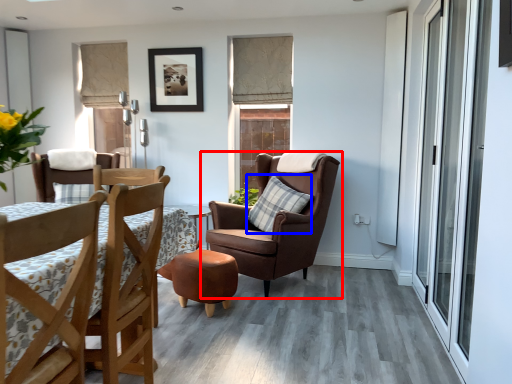
Question: Which point is further to the camera, chair (highlighted by a red box) or pillow (highlighted by a blue box)?

Choices:
 (A) chair
 (B) pillow

Answer: (B)